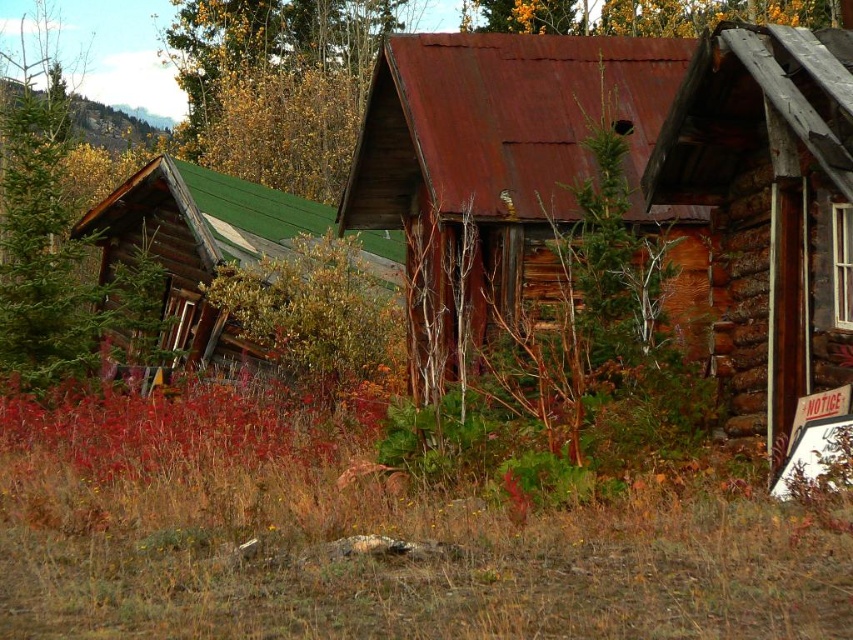
Is rusty metal hut at center positioned at the back of green wood tree at upper left?

No, it is in front of green wood tree at upper left.

Can you confirm if rusty metal hut at center is taller than green wood tree at upper left?

In fact, rusty metal hut at center may be shorter than green wood tree at upper left.

The width and height of the screenshot is (853, 640). What do you see at coordinates (630, 182) in the screenshot? I see `rusty metal hut at center` at bounding box center [630, 182].

Where is `rusty metal hut at center`? The image size is (853, 640). rusty metal hut at center is located at coordinates (630, 182).

Does rusty metal hut at center appear on the right side of green wood cabin at left?

Correct, you'll find rusty metal hut at center to the right of green wood cabin at left.

Who is shorter, rusty metal hut at center or green wood cabin at left?

Standing shorter between the two is green wood cabin at left.

Find the location of a particular element. This screenshot has height=640, width=853. rusty metal hut at center is located at coordinates (630, 182).

I want to click on rusty metal hut at center, so click(630, 182).

Between point (827, 96) and point (234, 1), which one is positioned behind?

Positioned behind is point (234, 1).

Describe the element at coordinates (769, 209) in the screenshot. I see `weathered wood log cabin at right` at that location.

Is point (755, 32) positioned before point (256, 77)?

Yes, it is.

Where is `weathered wood log cabin at right`? weathered wood log cabin at right is located at coordinates (769, 209).